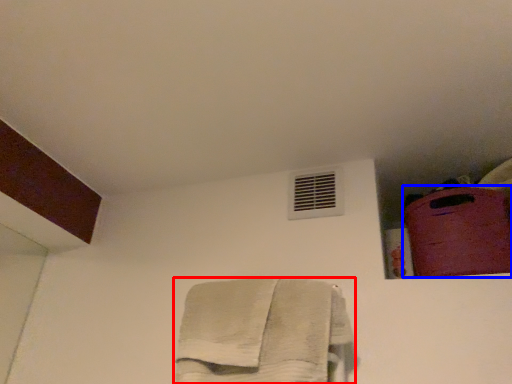
Question: Which object appears farthest to the camera in this image, towel (highlighted by a red box) or luggage (highlighted by a blue box)?

Choices:
 (A) towel
 (B) luggage

Answer: (B)